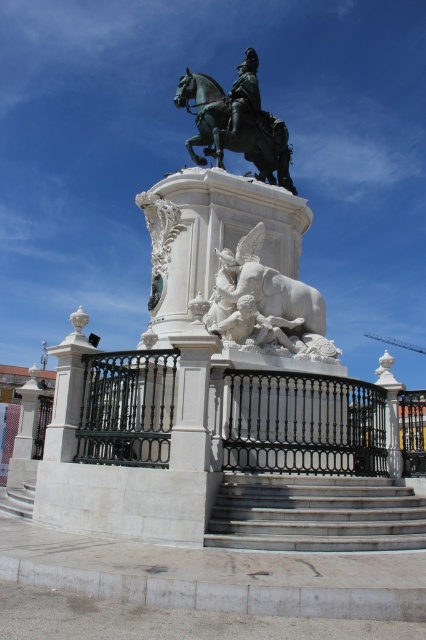
Can you confirm if gray stone stairs at center is positioned below white marble statue at center?

Yes, gray stone stairs at center is below white marble statue at center.

Describe the element at coordinates (316, 513) in the screenshot. I see `gray stone stairs at center` at that location.

Where is `gray stone stairs at center`? The image size is (426, 640). gray stone stairs at center is located at coordinates (316, 513).

Identify the location of gray stone stairs at center. (x=316, y=513).

Does point (215, 154) come farther from viewer compared to point (270, 330)?

Yes.

Does green polished metal horse at upper center appear over white marble statue at center?

Yes.

Is point (210, 124) closer to camera compared to point (247, 312)?

No, it is behind (247, 312).

Image resolution: width=426 pixels, height=640 pixels. In order to click on green polished metal horse at upper center in this screenshot , I will do `click(235, 131)`.

Is white marble elephant at center shorter than green polished metal horse at upper center?

Yes, white marble elephant at center is shorter than green polished metal horse at upper center.

Does white marble elephant at center appear under green polished metal horse at upper center?

Yes, white marble elephant at center is below green polished metal horse at upper center.

Between point (247, 339) and point (198, 104), which one is positioned behind?

Point (198, 104)

Identify the location of white marble elephant at center. This screenshot has width=426, height=640. (265, 304).